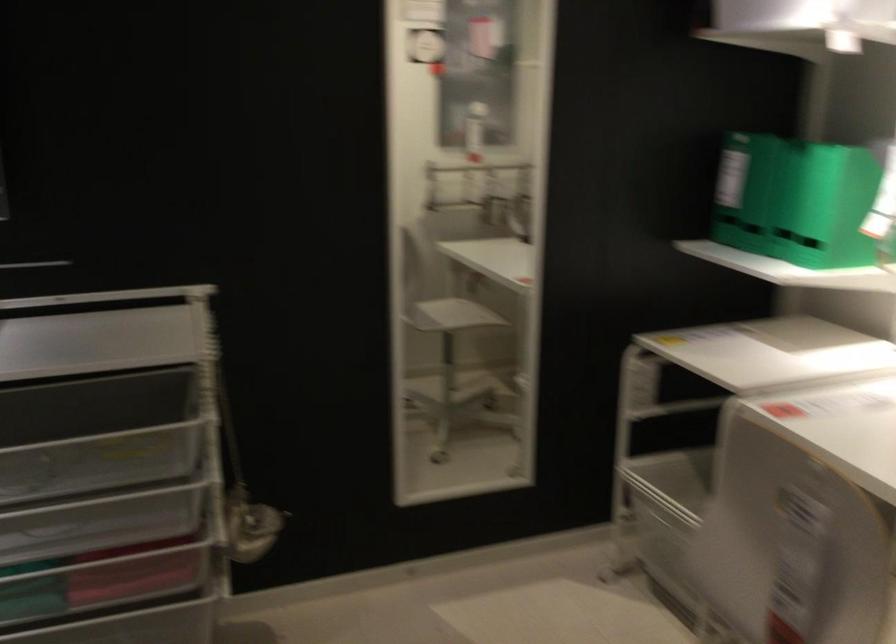
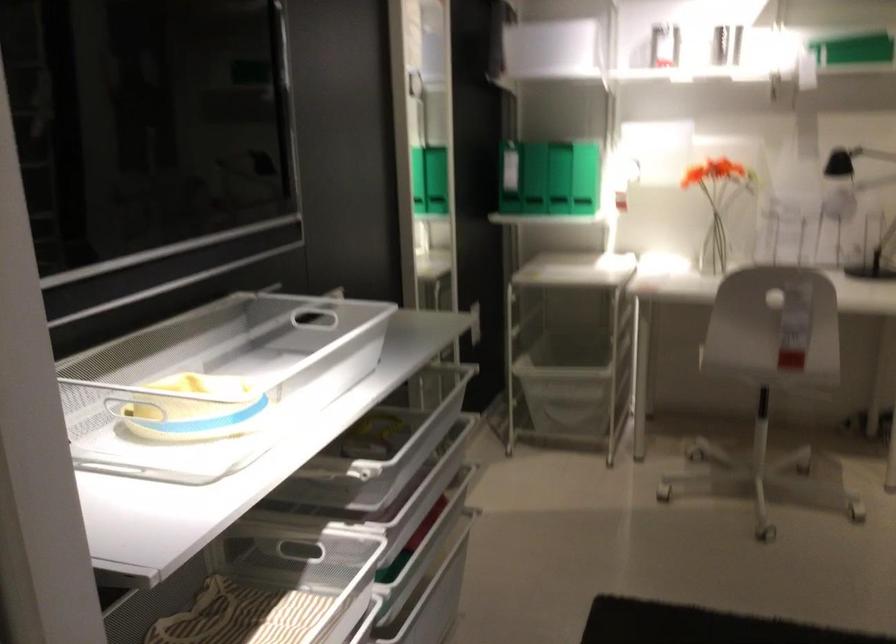
Where in the second image is the point corresponding to pixel 658 518 from the first image?

(566, 381)